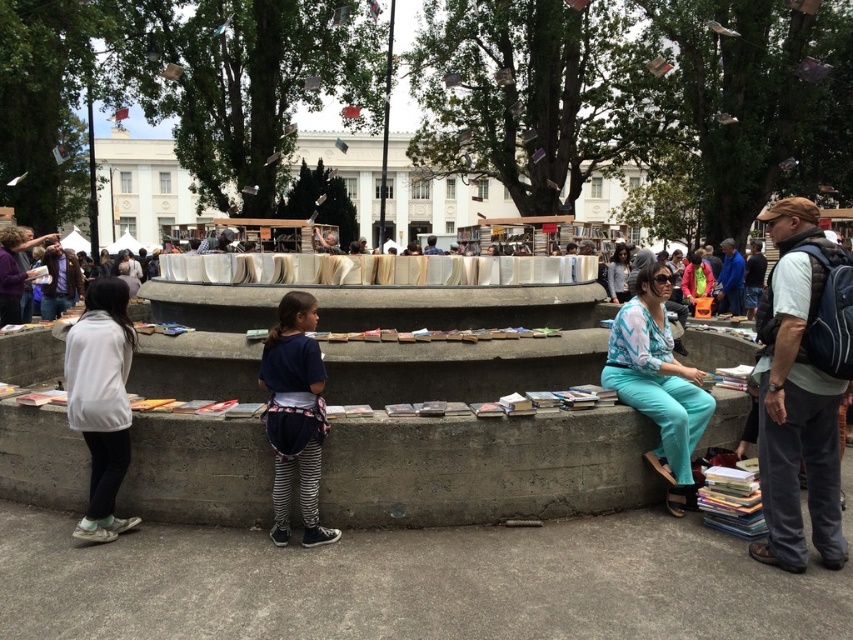
Does point (622, 330) lie in front of point (96, 531)?

That is False.

Who is lower down, teal fabric pants at center or white matte jacket at left?

white matte jacket at left is lower down.

The image size is (853, 640). Find the location of `teal fabric pants at center`. teal fabric pants at center is located at coordinates (657, 381).

Which is more to the left, dark gray pants at right or teal fabric pants at center?

teal fabric pants at center

Does dark gray pants at right have a greater height compared to teal fabric pants at center?

Indeed, dark gray pants at right has a greater height compared to teal fabric pants at center.

Find the location of a particular element. This screenshot has height=640, width=853. dark gray pants at right is located at coordinates (796, 397).

I want to click on dark gray pants at right, so pyautogui.click(x=796, y=397).

Does dark gray pants at right have a greater height compared to dark blue jersey at center?

Correct, dark gray pants at right is much taller as dark blue jersey at center.

What do you see at coordinates (796, 397) in the screenshot?
I see `dark gray pants at right` at bounding box center [796, 397].

Who is more forward, (810, 308) or (281, 515)?

Point (810, 308) is in front.

The image size is (853, 640). In order to click on dark gray pants at right in this screenshot , I will do `click(796, 397)`.